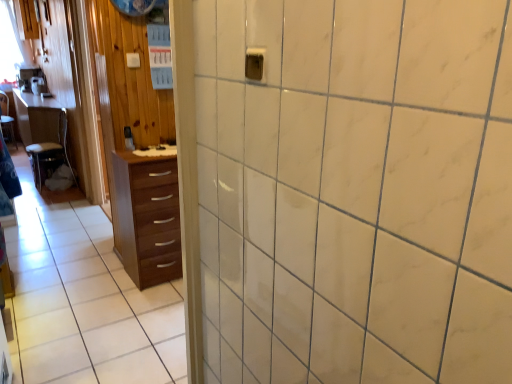
What do you see at coordinates (37, 118) in the screenshot? I see `wooden table at left` at bounding box center [37, 118].

What is the approximate height of wooden table at left?

wooden table at left is 86.71 centimeters in height.

This screenshot has width=512, height=384. Find the location of `brown wood chest of drawers at left`. brown wood chest of drawers at left is located at coordinates (147, 217).

Can we say wooden chair at left lies outside wooden table at left?

wooden chair at left lies outside wooden table at left's area.

Locate an element on the screen. Image resolution: width=512 pixels, height=384 pixels. table that appears above the wooden chair at left (from the image's perspective) is located at coordinates (37, 118).

Is wooden chair at left taller than wooden table at left?

Incorrect, the height of wooden chair at left is not larger of that of wooden table at left.

Which point is more distant from viewer, (54, 142) or (48, 136)?

The point (48, 136) is more distant.

Is brown wood chest of drawers at left at the back of wooden chair at left?

That's not correct — wooden chair at left is not looking away from brown wood chest of drawers at left.

Considering the points (62, 150) and (154, 278), which point is behind, point (62, 150) or point (154, 278)?

The point (62, 150) is behind.

Is wooden chair at left further to the viewer compared to brown wood chest of drawers at left?

That is True.

Which object is wider, wooden chair at left or brown wood chest of drawers at left?

With larger width is wooden chair at left.

Is wooden table at left to the left or to the right of brown wood chest of drawers at left in the image?

Clearly, wooden table at left is on the left of brown wood chest of drawers at left in the image.

In the scene shown: How different are the orientations of wooden table at left and brown wood chest of drawers at left in degrees?

They differ by 91.4 degrees in their facing directions.

Is wooden table at left with brown wood chest of drawers at left?

No, wooden table at left is not next to brown wood chest of drawers at left.

From a real-world perspective, between wooden table at left and wooden chair at left, who is vertically higher?

In real-world perspective, wooden table at left is above.

Which object is wider, wooden table at left or wooden chair at left?

wooden table at left.

Is wooden table at left bigger than wooden chair at left?

Yes, wooden table at left is bigger than wooden chair at left.

Is brown wood chest of drawers at left aimed at wooden table at left?

No, brown wood chest of drawers at left is not oriented towards wooden table at left.

The width and height of the screenshot is (512, 384). I want to click on chest of drawers on the right of wooden table at left, so click(147, 217).

In terms of width, does brown wood chest of drawers at left look wider or thinner when compared to wooden table at left?

In the image, brown wood chest of drawers at left appears to be more narrow than wooden table at left.

Who is taller, brown wood chest of drawers at left or wooden table at left?

wooden table at left.

Would you say brown wood chest of drawers at left is a long distance from wooden chair at left?

Absolutely, brown wood chest of drawers at left is distant from wooden chair at left.

Is brown wood chest of drawers at left turned away from wooden chair at left?

Yes, brown wood chest of drawers at left is facing away from wooden chair at left.

Is brown wood chest of drawers at left inside or outside of wooden chair at left?

brown wood chest of drawers at left is located beyond the bounds of wooden chair at left.

Visually, is brown wood chest of drawers at left positioned to the left or to the right of wooden chair at left?

Clearly, brown wood chest of drawers at left is on the right of wooden chair at left in the image.

The width and height of the screenshot is (512, 384). I want to click on table above the wooden chair at left (from the image's perspective), so [x=37, y=118].

This screenshot has width=512, height=384. Find the location of `furniture below the brown wood chest of drawers at left (from a real-world perspective)`. furniture below the brown wood chest of drawers at left (from a real-world perspective) is located at coordinates (51, 147).

Which object lies further to the anchor point brown wood chest of drawers at left, wooden chair at left or wooden table at left?

Based on the image, wooden table at left appears to be further to brown wood chest of drawers at left.

Which object lies nearer to the anchor point brown wood chest of drawers at left, wooden table at left or wooden chair at left?

The object closer to brown wood chest of drawers at left is wooden chair at left.

When comparing their distances from wooden chair at left, does wooden table at left or brown wood chest of drawers at left seem further?

brown wood chest of drawers at left.

Estimate the real-world distances between objects in this image. Which object is closer to wooden chair at left, brown wood chest of drawers at left or wooden table at left?

wooden table at left lies closer to wooden chair at left than the other object.

Which object lies further to the anchor point wooden table at left, brown wood chest of drawers at left or wooden chair at left?

brown wood chest of drawers at left is positioned further to the anchor wooden table at left.

Estimate the real-world distances between objects in this image. Which object is closer to wooden table at left, wooden chair at left or brown wood chest of drawers at left?

wooden chair at left is closer to wooden table at left.

The width and height of the screenshot is (512, 384). Identify the location of furniture between wooden table at left and brown wood chest of drawers at left in the horizontal direction. [51, 147].